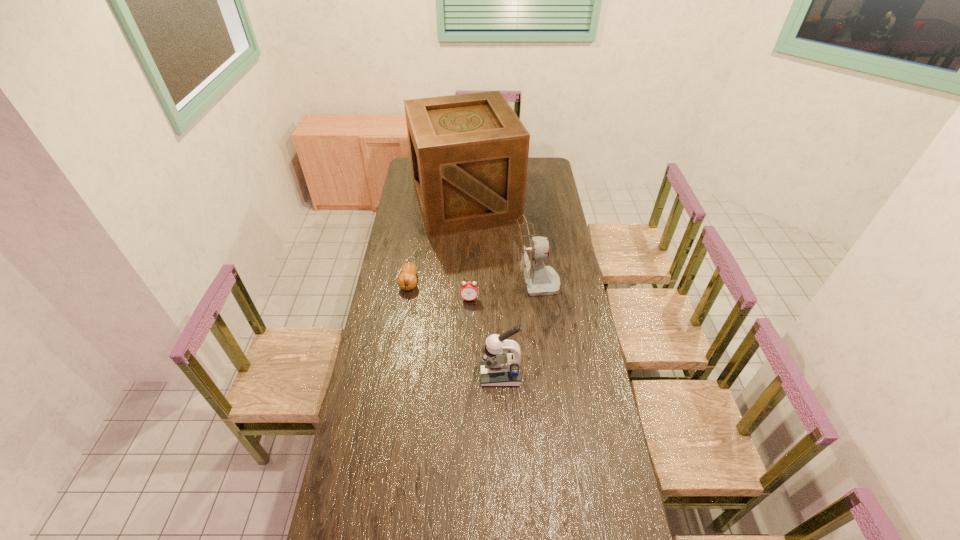
This screenshot has width=960, height=540. In the image, there is a desktop. In order to click on vacant space at the right edge in this screenshot , I will do `click(613, 456)`.

Image resolution: width=960 pixels, height=540 pixels. Identify the location of vacant position at the far right corner of the desktop. (555, 176).

I want to click on free space that is in between the gourd and the microscope, so click(x=455, y=328).

You are a GUI agent. You are given a task and a screenshot of the screen. Output one action in this format:
    pyautogui.click(x=<x>, y=<y>)
    Task: Click on the free spot between the alarm clock and the gourd
    
    Given the screenshot: What is the action you would take?
    pyautogui.click(x=440, y=291)

Where is `vacant area between the alarm clock and the microscope`? This screenshot has width=960, height=540. vacant area between the alarm clock and the microscope is located at coordinates (485, 336).

Identify the location of vacant space that is in between the third shortest object and the alarm clock. The image size is (960, 540). (485, 336).

This screenshot has width=960, height=540. Identify the location of vacant region between the microscope and the farthest object. coord(483,288).

This screenshot has height=540, width=960. I want to click on empty space that is in between the third shortest object and the tallest object, so click(483, 288).

Where is `empty space between the alarm clock and the gourd`? This screenshot has height=540, width=960. empty space between the alarm clock and the gourd is located at coordinates (440, 291).

Identify the location of empty space between the gourd and the alarm clock. (440, 291).